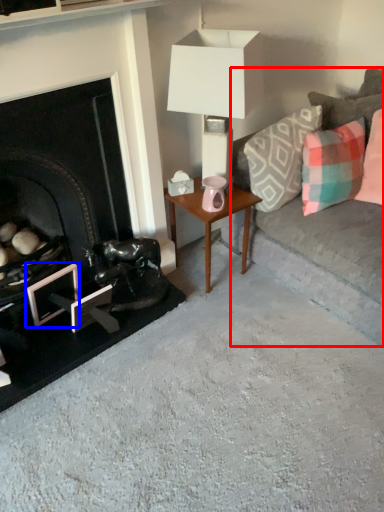
Question: Which point is closer to the camera, studio couch (highlighted by a red box) or picture frame (highlighted by a blue box)?

Choices:
 (A) studio couch
 (B) picture frame

Answer: (A)